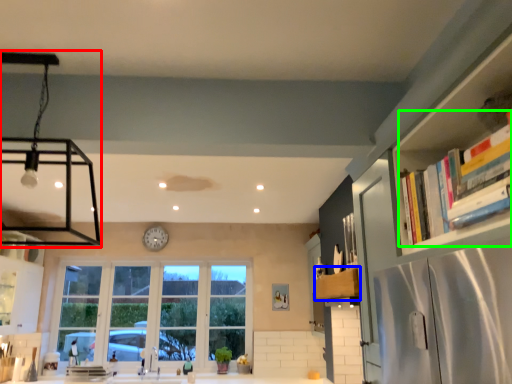
Question: Which is nearer to the light fixture (highlighted by a red box)? cabinetry (highlighted by a blue box) or book (highlighted by a green box).

Choices:
 (A) cabinetry
 (B) book

Answer: (A)